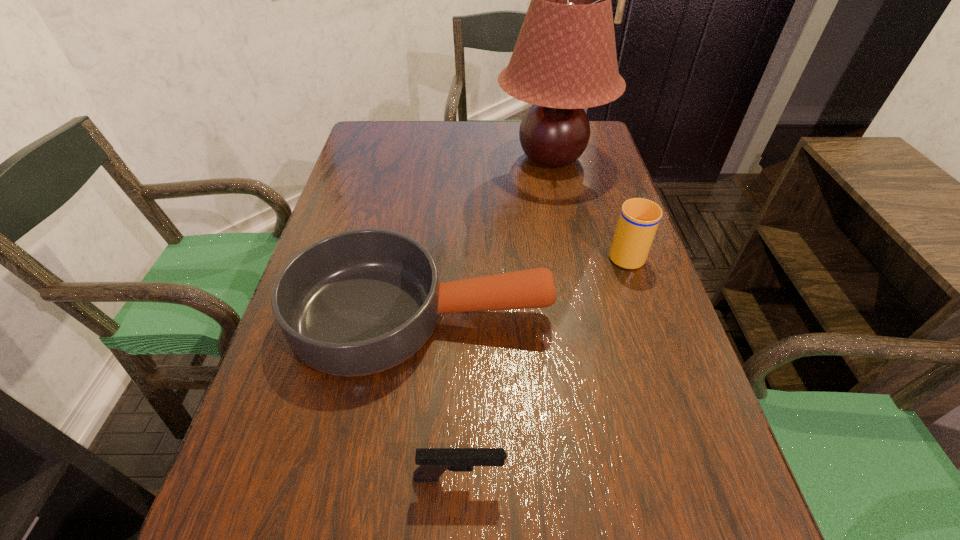
The width and height of the screenshot is (960, 540). I want to click on vacant space located 0.120m on the side of the cup with the handle, so click(x=610, y=206).

Identify the location of free space located 0.340m on the side of the cup with the handle. Image resolution: width=960 pixels, height=540 pixels. (594, 160).

Locate an element on the screen. The image size is (960, 540). vacant space located 0.210m on the handle side of the pan is located at coordinates (655, 315).

You are a GUI agent. You are given a task and a screenshot of the screen. Output one action in this format:
    pyautogui.click(x=<x>, y=<y>)
    Task: Click on the free space located on the front-facing side of the shortest object
    This screenshot has width=960, height=540.
    Given the screenshot: What is the action you would take?
    pyautogui.click(x=629, y=477)

You are a GUI agent. You are given a task and a screenshot of the screen. Output one action in this format:
    pyautogui.click(x=<x>, y=<y>)
    Task: Click on the object present at the far edge
    Image resolution: width=960 pixels, height=540 pixels.
    Given the screenshot: What is the action you would take?
    pyautogui.click(x=564, y=60)

This screenshot has height=540, width=960. Identify the location of object that is at the left edge. (359, 302).

Image resolution: width=960 pixels, height=540 pixels. I want to click on lampshade that is at the right edge, so pyautogui.click(x=564, y=60).

The width and height of the screenshot is (960, 540). I want to click on cup that is at the right edge, so click(x=639, y=218).

Locate an element on the screen. Image resolution: width=960 pixels, height=540 pixels. object present at the far right corner is located at coordinates (564, 60).

Where is `vacant space at the far edge`? This screenshot has height=540, width=960. vacant space at the far edge is located at coordinates (501, 132).